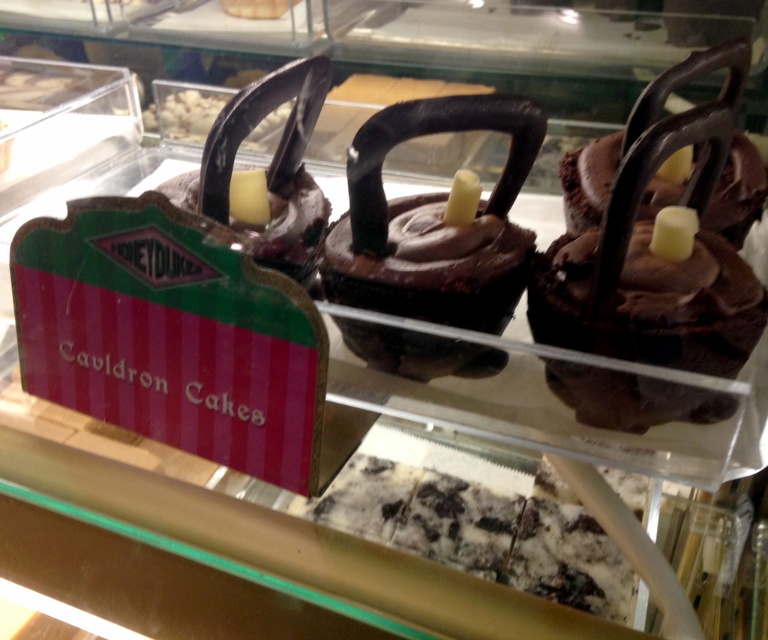
You are a customer trying to locate the exact position of the chocolatesmoothcupcake at center in the display case. According to the coordinates provided, where is it located?

The chocolatesmoothcupcake at center is located at coordinates point (x=432, y=221).

Looking at this image, you are a customer at Honeydukes and want to buy the widest item between the chocolatesmoothcupcake at center and the chocolate matte kettlebell at center. Which one should you choose?

The chocolatesmoothcupcake at center is wider than the chocolate matte kettlebell at center, so you should choose the chocolatesmoothcupcake at center.

You are a customer at Honeydukes and want to buy the chocolatesmoothcupcake at center and the chocolate matte kettlebell at center. The cashier asks you to describe their positions to confirm. Based on the scene description, which cupcake is on the right side?

The chocolatesmoothcupcake at center is to the right of the chocolate matte kettlebell at center.